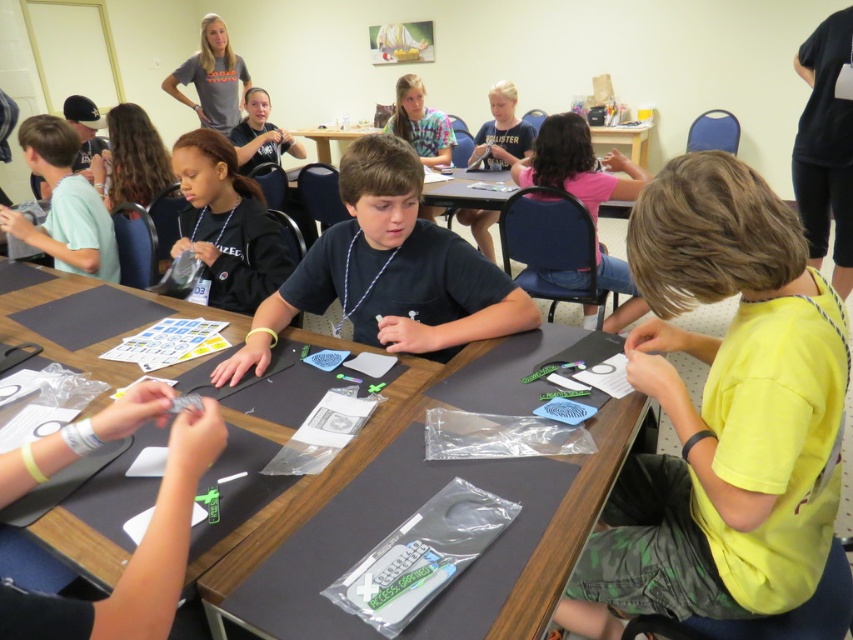
Question: Which point is closer to the camera?

Choices:
 (A) gray cotton shirt at upper left
 (B) black matte necklace at center

Answer: (B)

Question: From the image, what is the correct spatial relationship of wooden table at center in relation to gray cotton shirt at upper left?

Choices:
 (A) above
 (B) below

Answer: (B)

Question: Which is farther from the black matte necklace at center?

Choices:
 (A) wooden table at center
 (B) gray cotton shirt at upper left
 (C) pink fabric shirt at upper center

Answer: (B)

Question: Which object is closer to the camera taking this photo?

Choices:
 (A) matte plastic table at center
 (B) dark blue shirt at center

Answer: (B)

Question: Does yellow matte shirt at center have a larger size compared to dark blue shirt at center?

Choices:
 (A) yes
 (B) no

Answer: (A)

Question: Can you confirm if yellow matte shirt at center is smaller than black matte necklace at center?

Choices:
 (A) yes
 (B) no

Answer: (B)